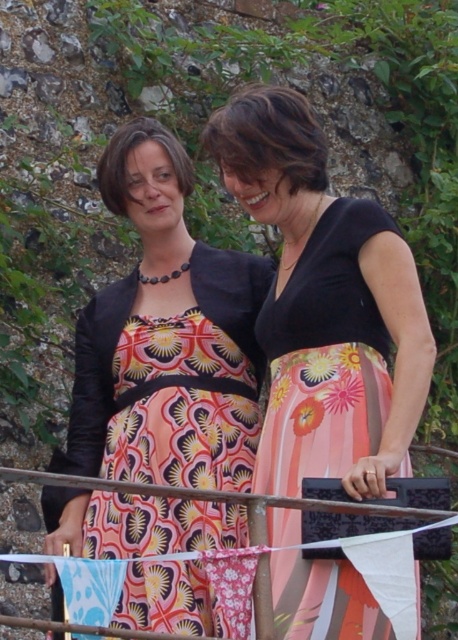
In the scene shown: You are a photographer setting up a shoot. You need to position a camera so that the matte black dress at center is in focus and the metallic silver rail at center is blurred in the background. Based on the scene description, is this possible?

Yes, because the metallic silver rail at center is behind the matte black dress at center, adjusting the camera focus on the dress would blur the rail in the background.

You are a photographer setting up a shoot. You have two dresses to feature in the image. The matte black dress at center and the printed fabric dress at center. Which dress should you focus on if you want to highlight a larger garment in the scene?

The matte black dress at center is larger in size than the printed fabric dress at center, so you should focus on the matte black dress at center to highlight the larger garment.

Looking at this image, you are taking a photo of the two women standing near the stone wall. You want to focus on the point closer to the camera. Which point should you focus on, point (75, 422) or point (87, 515)?

Point (75, 422) is further to the camera than point (87, 515), so you should focus on point (75, 422) as it is closer to the camera.